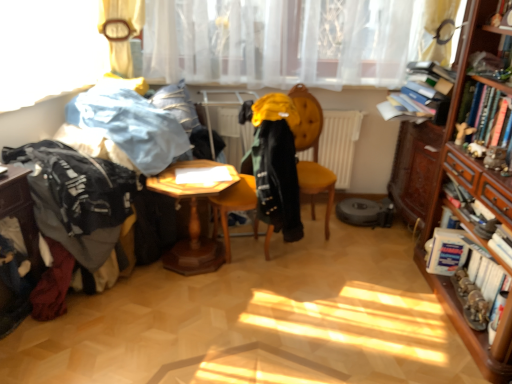
Locate an element on the screen. vacant area that lies to the right of wooden hexagonal table at center, marked as the second table in a left-to-right arrangement is located at coordinates (270, 276).